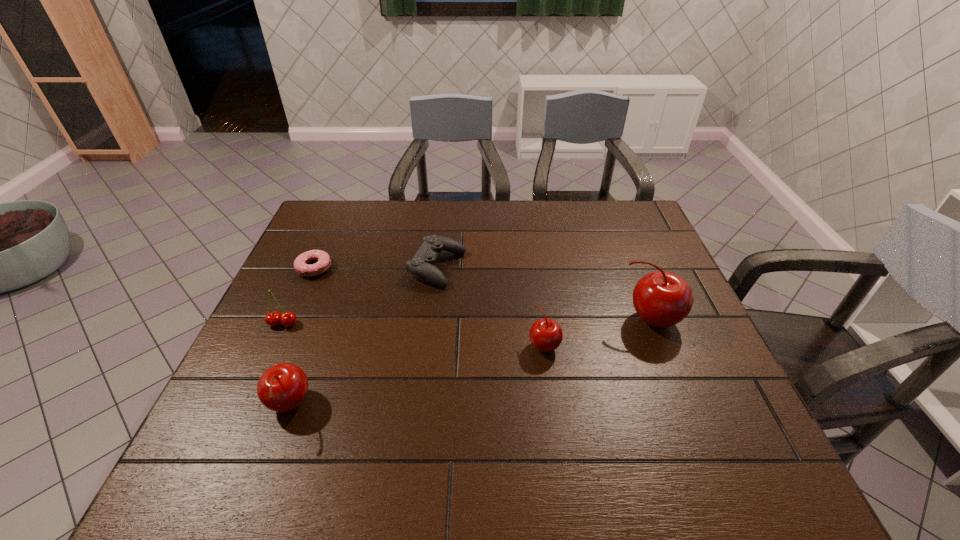
Identify the location of free space at the near edge. (560, 420).

I want to click on vacant area at the left edge, so click(345, 245).

In the image, there is a desktop. At what (x,y) coordinates should I click in order to perform the action: click on vacant space at the right edge. Please return your answer as a coordinate pair (x, y). The height and width of the screenshot is (540, 960). Looking at the image, I should click on (621, 278).

At what (x,y) coordinates should I click in order to perform the action: click on vacant region at the far left corner of the desktop. Please return your answer as a coordinate pair (x, y). Looking at the image, I should click on (318, 225).

What are the coordinates of `free location at the near left corner of the desktop` in the screenshot? It's located at (264, 408).

At what (x,y) coordinates should I click in order to perform the action: click on free space that is in between the doughnut and the third object from right to left. Please return your answer as a coordinate pair (x, y). Looking at the image, I should click on (376, 268).

The height and width of the screenshot is (540, 960). Find the location of `free space between the second object from right to left and the fourth object from left to right`. free space between the second object from right to left and the fourth object from left to right is located at coordinates [x=491, y=306].

Where is `empty location between the doughnut and the third object from right to left`? empty location between the doughnut and the third object from right to left is located at coordinates (376, 268).

Where is `vacant area that lies between the leftmost cherry and the rightmost cherry`? vacant area that lies between the leftmost cherry and the rightmost cherry is located at coordinates (467, 322).

What are the coordinates of `unoccupied position between the fifth tallest object and the doughnut` in the screenshot? It's located at (376, 268).